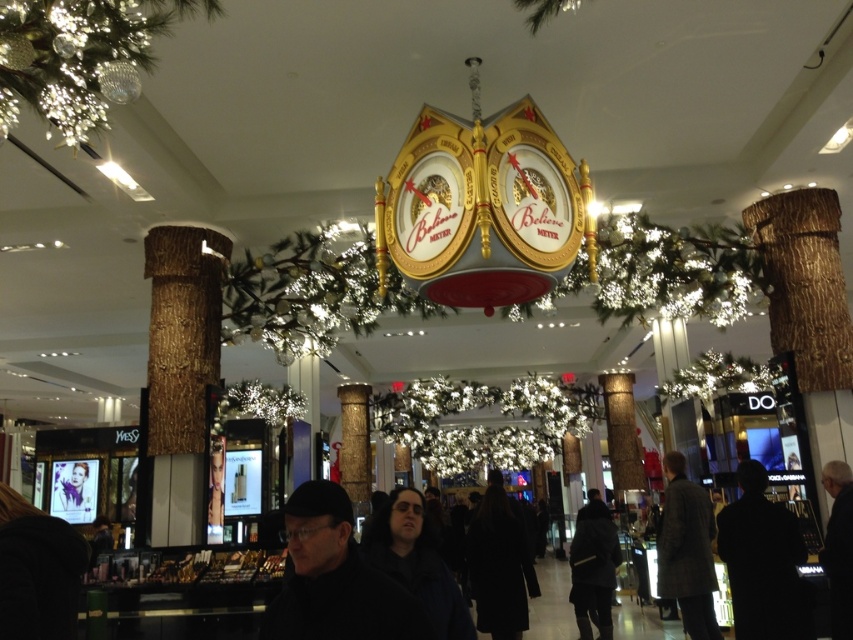
Question: Which point appears closest to the camera in this image?

Choices:
 (A) (740, 536)
 (B) (39, 524)

Answer: (B)

Question: Which point is closer to the camera taking this photo?

Choices:
 (A) tap(824, 488)
 (B) tap(505, 499)
 (C) tap(735, 593)
 (D) tap(329, 547)

Answer: (D)

Question: Can you confirm if dark matte coat at center is positioned below dark brown textured coat at lower right?

Choices:
 (A) yes
 (B) no

Answer: (B)

Question: Is dark gray coat at lower left bigger than dark gray suit at lower right?

Choices:
 (A) no
 (B) yes

Answer: (A)

Question: Is the position of black matte coat at center less distant than that of dark gray suit at lower right?

Choices:
 (A) yes
 (B) no

Answer: (A)

Question: Which of the following is the closest to the observer?

Choices:
 (A) silhouette jacket at lower right
 (B) dark gray suit at lower right

Answer: (B)